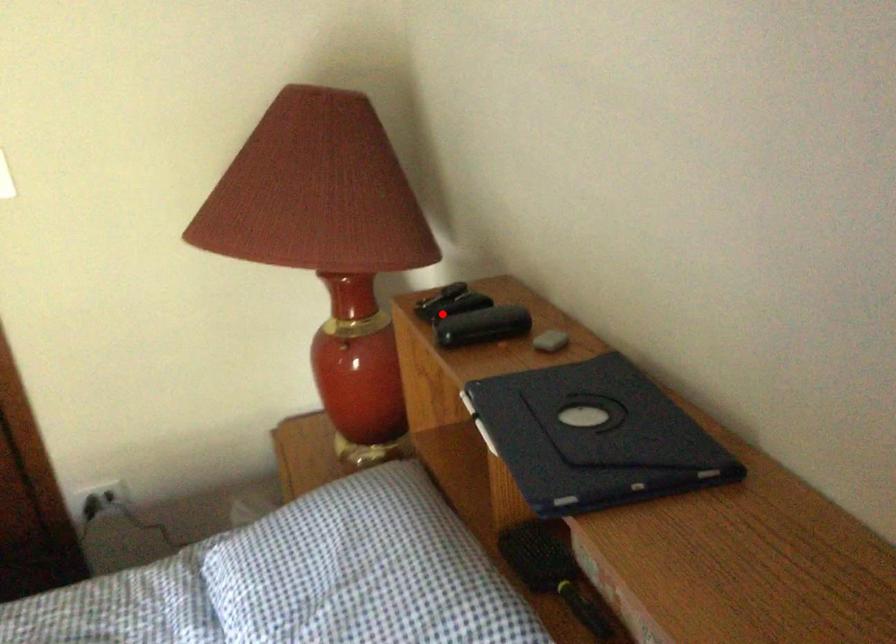
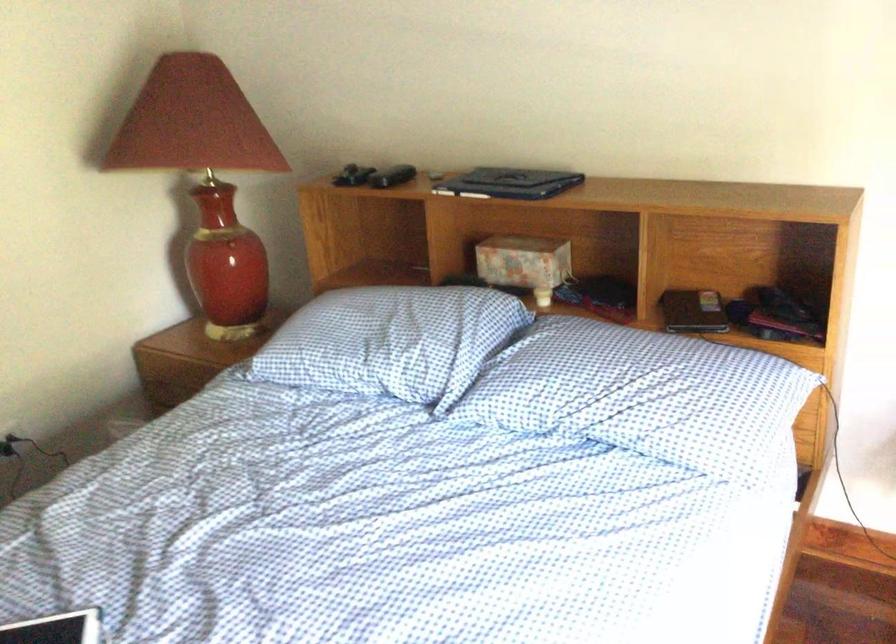
In the second image, find the point that corresponds to the highlighted location in the first image.

(352, 176)